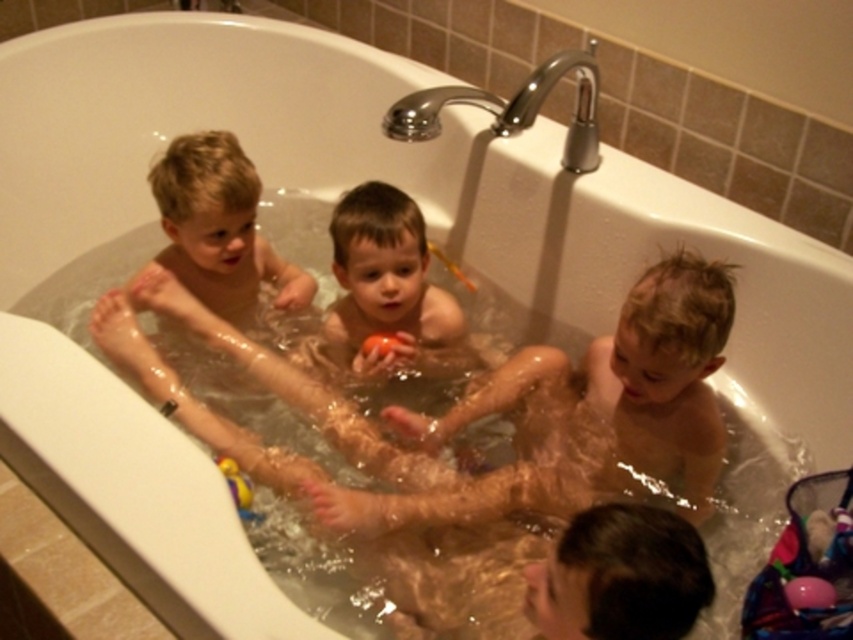
From the picture: You are a parent trying to decide which toy to give to your child. The yellow rubber duck at lower left and the rubber matte ball at center are both in the bathtub. Which toy is larger in size?

The yellow rubber duck at lower left is bigger than the rubber matte ball at center, so the yellow rubber duck at lower left is larger in size.

You are a parent trying to retrieve the rubber matte ball at center from the bathtub. The smooth skin child at center is in the way. Can you reach the ball without moving the child?

The smooth skin child at center is in front of the rubber matte ball at center, so you cannot reach the ball without moving the child.